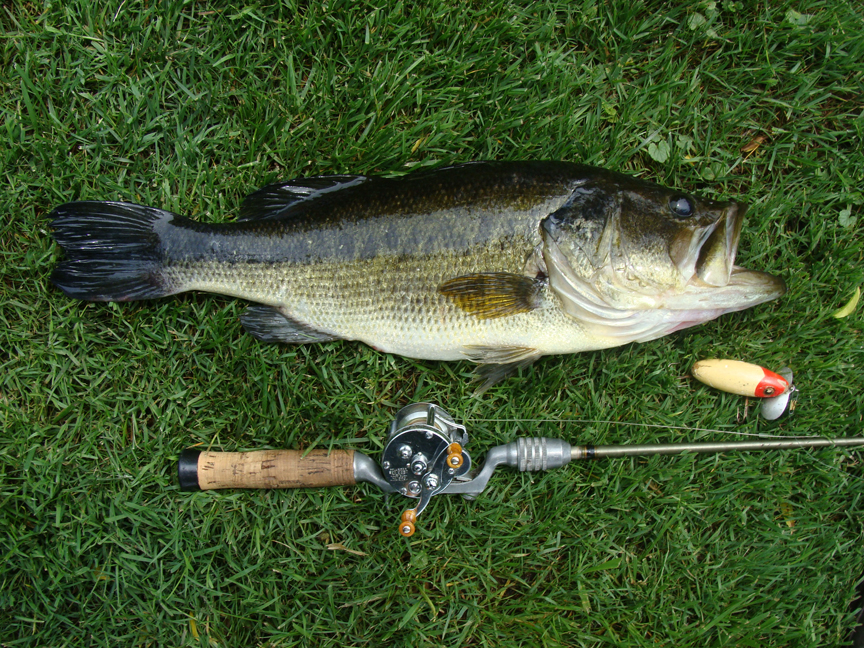
Where is `handle on rod`? This screenshot has height=648, width=864. handle on rod is located at coordinates (295, 470).